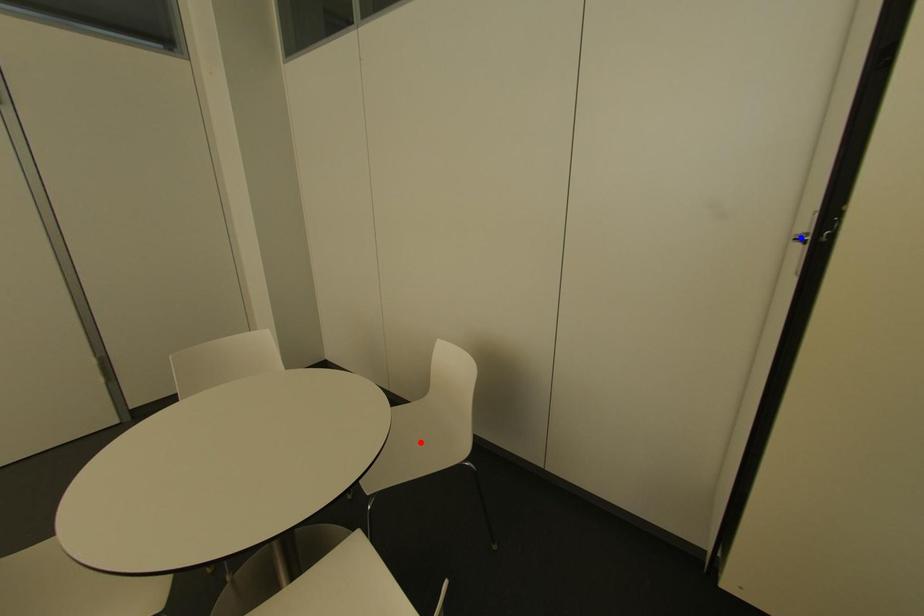
Question: Which of the two points in the image is closer to the camera?

Choices:
 (A) Blue point is closer.
 (B) Red point is closer.

Answer: (A)